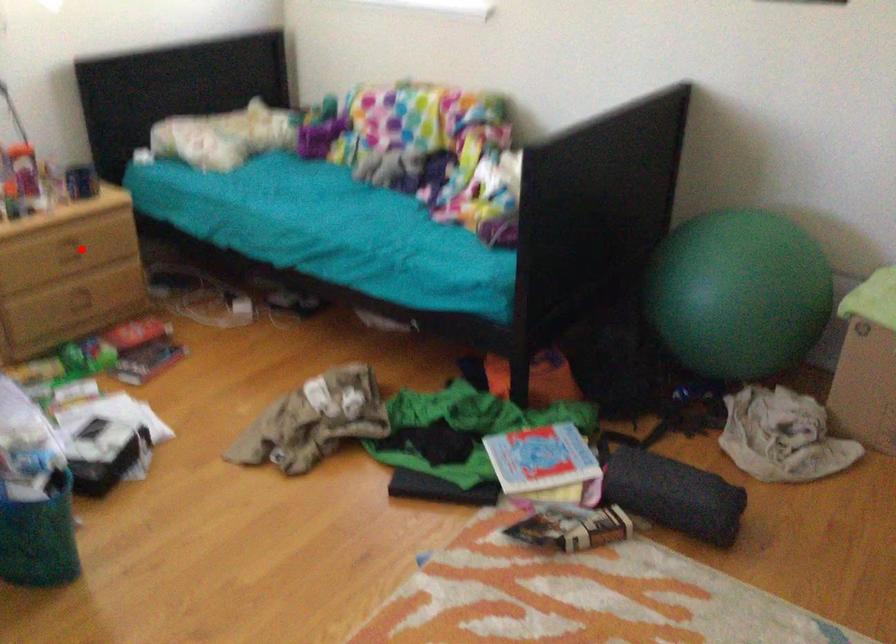
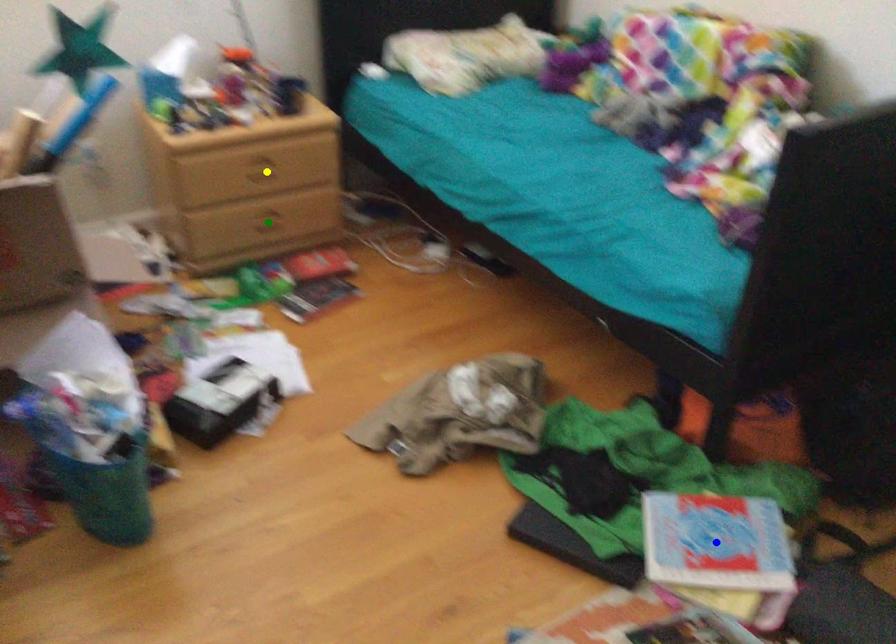
Question: I am providing you with two images of the same scene from different viewpoints. A red point is marked on the first image. You are given multiple points on the second image. Which spot in image 2 lines up with the point in image 1?

Choices:
 (A) yellow point
 (B) blue point
 (C) green point

Answer: (A)